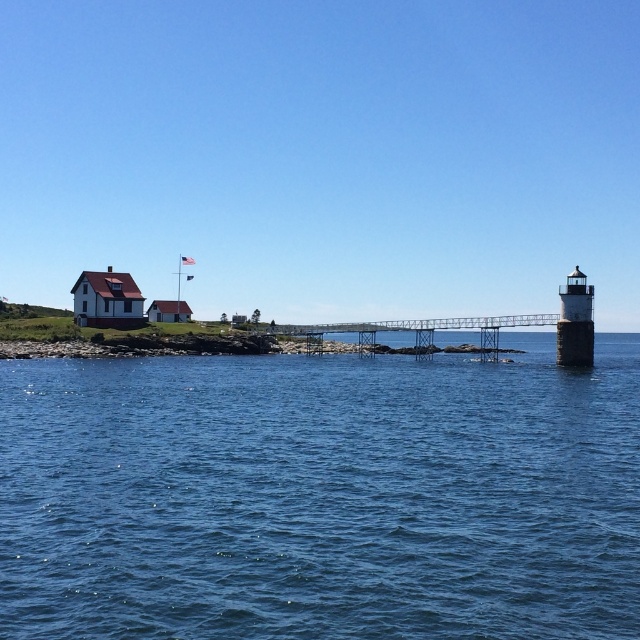
Is blue water at center below white fabric flag at upper center?

Correct, blue water at center is located below white fabric flag at upper center.

Who is shorter, blue water at center or white fabric flag at upper center?

With less height is white fabric flag at upper center.

Describe the element at coordinates (321, 496) in the screenshot. I see `blue water at center` at that location.

Locate an element on the screen. This screenshot has width=640, height=640. blue water at center is located at coordinates (321, 496).